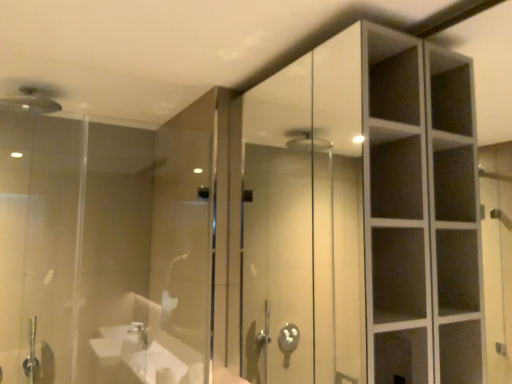
I want to click on empty space that is ontop of white glossy cabinet at upper right (from a real-world perspective), so click(304, 56).